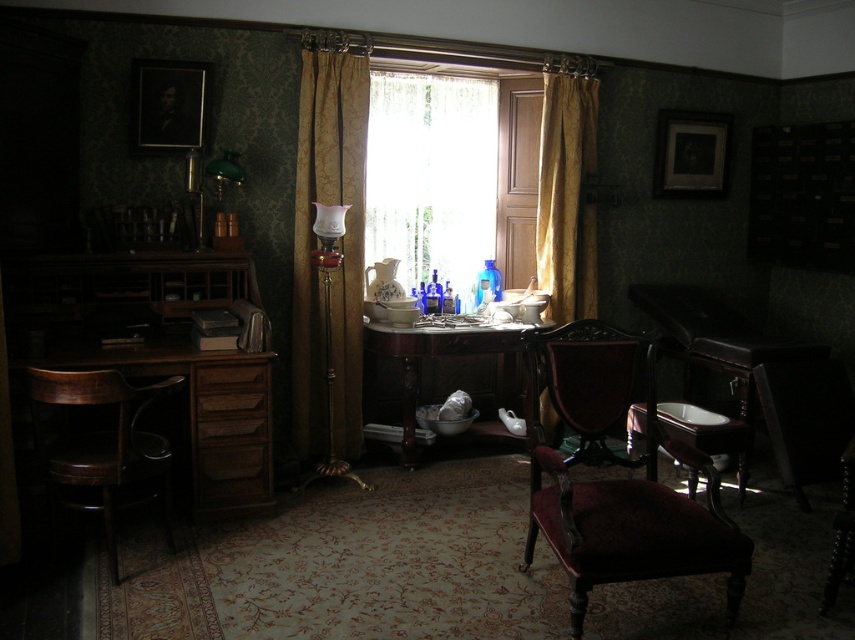
You are a delivery person who needs to place a rectangular package that measures 1.5 meters in length. You see the velvet burgundy armchair at center and the wooden table at center in the room. Can you fit the package between them without bending it?

The velvet burgundy armchair at center and wooden table at center are 1.43 meters apart from each other. Since the package is 1.5 meters long, it cannot fit between them without bending as the distance is shorter than the package length.

You are standing in the room and want to sit down. You see the velvet burgundy armchair at center and the wooden drawer at lower left. Which object is closer to you?

The velvet burgundy armchair at center is closer to the viewer than the wooden drawer at lower left.

You are a guest in this room and want to sit down comfortably. The velvet burgundy armchair at center and the wooden table at center are both in your view. Which one is taller?

The velvet burgundy armchair at center is taller than the wooden table at center.